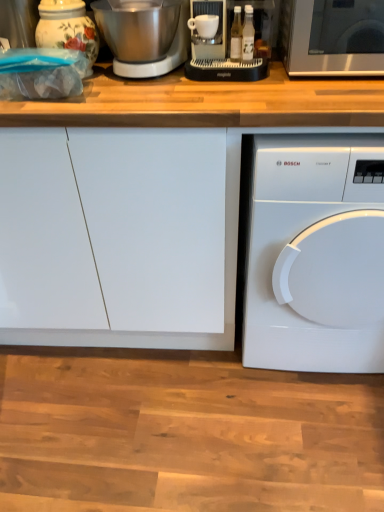
Question: Based on their sizes in the image, would you say white glossy dishwasher at lower right is bigger or smaller than wooden at upper center?

Choices:
 (A) big
 (B) small

Answer: (B)

Question: From the image's perspective, is white glossy dishwasher at lower right above or below wooden at upper center?

Choices:
 (A) above
 (B) below

Answer: (B)

Question: Considering the real-world distances, which object is closest to the sleek silver microwave at upper right?

Choices:
 (A) matte black coffee machine at upper center
 (B) brushed metal mixer at upper left
 (C) white glossy dishwasher at lower right
 (D) wooden at upper center
 (E) porcelain floral jar at upper left

Answer: (A)

Question: Which is farther from the porcelain floral jar at upper left?

Choices:
 (A) brushed metal mixer at upper left
 (B) wooden at upper center
 (C) matte black coffee machine at upper center
 (D) sleek silver microwave at upper right
 (E) white glossy dishwasher at lower right

Answer: (E)